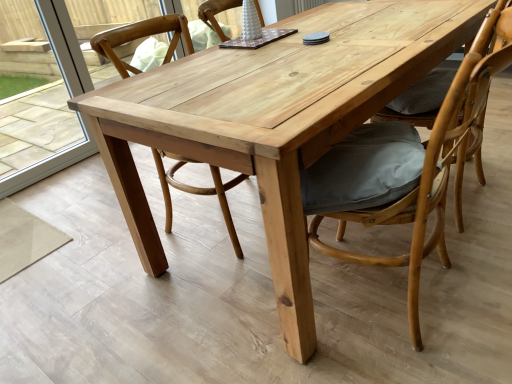
Where is `vacant area situated below wooden cushioned chair at center, arranged as the 2th chair when viewed from the left (from a real-world perspective)`? The height and width of the screenshot is (384, 512). vacant area situated below wooden cushioned chair at center, arranged as the 2th chair when viewed from the left (from a real-world perspective) is located at coordinates (420, 298).